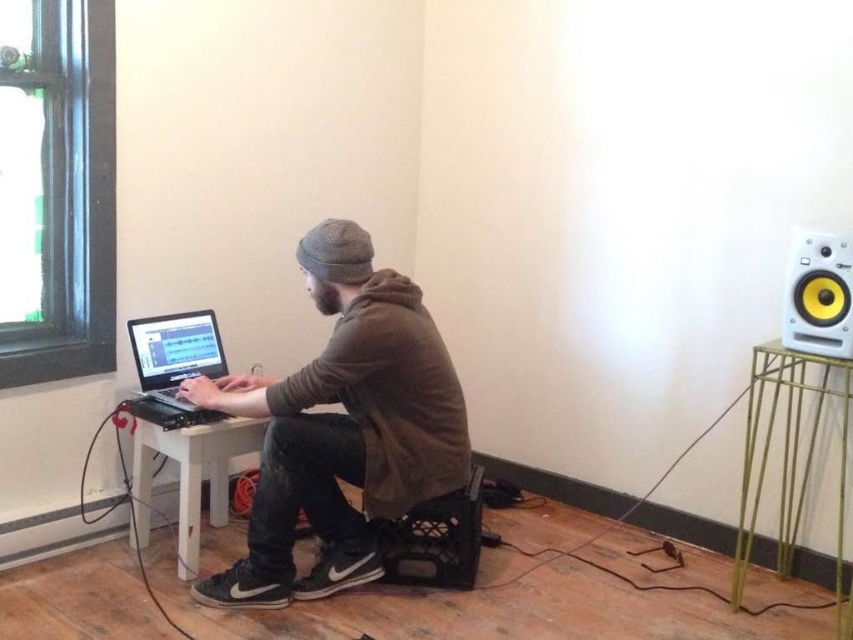
Question: In this image, where is gold metal table at right located relative to white plastic speaker at upper right?

Choices:
 (A) above
 (B) below

Answer: (B)

Question: Can you confirm if gold metal table at right is wider than black matte laptop at left?

Choices:
 (A) yes
 (B) no

Answer: (A)

Question: Does brown matte hoodie at center appear on the left side of gold metal table at right?

Choices:
 (A) yes
 (B) no

Answer: (A)

Question: Which of the following is the farthest from the observer?

Choices:
 (A) (183, 561)
 (B) (840, 476)
 (C) (158, 368)

Answer: (B)

Question: Which point is closer to the camera?

Choices:
 (A) brown matte hoodie at center
 (B) gold metal table at right
 (C) white wood table at lower left

Answer: (B)

Question: Which point is farther from the camera taking this photo?

Choices:
 (A) (844, 346)
 (B) (132, 321)
 (C) (347, 364)
 (D) (202, 444)

Answer: (B)